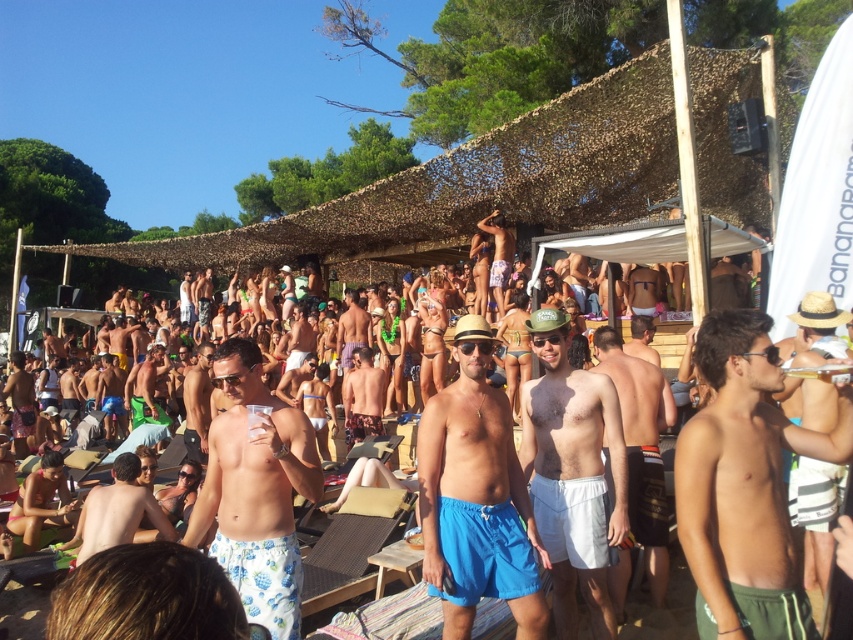
Does point (177, 538) lie behind point (346, 416)?

No.

Does smooth tan skin at lower left have a greater height compared to camouflage-patterned shorts at center?

In fact, smooth tan skin at lower left may be shorter than camouflage-patterned shorts at center.

Which is behind, point (93, 488) or point (364, 435)?

The point (364, 435) is behind.

Locate an element on the screen. The height and width of the screenshot is (640, 853). smooth tan skin at lower left is located at coordinates (117, 512).

Is green cotton shorts at center taller than camouflage-patterned shorts at center?

Correct, green cotton shorts at center is much taller as camouflage-patterned shorts at center.

Is green cotton shorts at center above camouflage-patterned shorts at center?

Yes.

Which is in front, point (775, 449) or point (373, 392)?

Positioned in front is point (775, 449).

This screenshot has width=853, height=640. I want to click on green cotton shorts at center, so click(746, 484).

In the scene shown: Is blue printed shorts at center thinner than smooth tan skin at lower left?

Correct, blue printed shorts at center's width is less than smooth tan skin at lower left's.

Based on the photo, can you confirm if blue printed shorts at center is positioned to the left of smooth tan skin at lower left?

No, blue printed shorts at center is not to the left of smooth tan skin at lower left.

Who is more distant from viewer, (239, 554) or (103, 486)?

The point (103, 486) is behind.

The height and width of the screenshot is (640, 853). Identify the location of blue printed shorts at center. (256, 490).